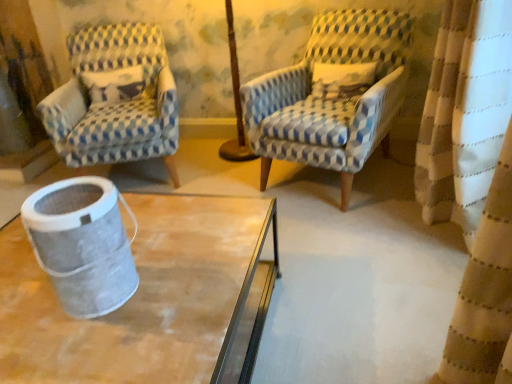
Question: Is blue and white checkered fabric armchair at center, arranged as the second chair when viewed from the left, shorter than metallic mesh trash can at lower left?

Choices:
 (A) yes
 (B) no

Answer: (B)

Question: From the image's perspective, does blue and white checkered fabric armchair at center, arranged as the second chair when viewed from the left, appear higher than metallic mesh trash can at lower left?

Choices:
 (A) yes
 (B) no

Answer: (A)

Question: Considering the relative positions of blue and white checkered fabric armchair at center, arranged as the second chair when viewed from the left, and metallic mesh trash can at lower left in the image provided, is blue and white checkered fabric armchair at center, arranged as the second chair when viewed from the left, to the right of metallic mesh trash can at lower left from the viewer's perspective?

Choices:
 (A) yes
 (B) no

Answer: (A)

Question: From a real-world perspective, is blue and white checkered fabric armchair at center, arranged as the second chair when viewed from the left, over metallic mesh trash can at lower left?

Choices:
 (A) yes
 (B) no

Answer: (B)

Question: From the image's perspective, would you say blue and white checkered fabric armchair at center, arranged as the second chair when viewed from the left, is shown under metallic mesh trash can at lower left?

Choices:
 (A) no
 (B) yes

Answer: (A)

Question: In terms of width, does blue and white checkered fabric armchair at left, the 2th chair positioned from the right, look wider or thinner when compared to metallic mesh trash can at lower left?

Choices:
 (A) wide
 (B) thin

Answer: (A)

Question: Based on their sizes in the image, would you say blue and white checkered fabric armchair at left, the first chair positioned from the left, is bigger or smaller than metallic mesh trash can at lower left?

Choices:
 (A) big
 (B) small

Answer: (A)

Question: Relative to metallic mesh trash can at lower left, is blue and white checkered fabric armchair at left, the first chair positioned from the left, in front or behind?

Choices:
 (A) front
 (B) behind

Answer: (B)

Question: From a real-world perspective, relative to metallic mesh trash can at lower left, is blue and white checkered fabric armchair at left, the 2th chair positioned from the right, vertically above or below?

Choices:
 (A) above
 (B) below

Answer: (B)

Question: From a real-world perspective, relative to blue and white checkered fabric armchair at left, the 2th chair positioned from the right, is blue and white checkered fabric armchair at center, arranged as the first chair when viewed from the right, vertically above or below?

Choices:
 (A) above
 (B) below

Answer: (A)

Question: Considering the positions of point (307, 150) and point (170, 160), is point (307, 150) closer or farther from the camera than point (170, 160)?

Choices:
 (A) farther
 (B) closer

Answer: (B)

Question: In terms of size, does blue and white checkered fabric armchair at center, arranged as the first chair when viewed from the right, appear bigger or smaller than blue and white checkered fabric armchair at left, the first chair positioned from the left?

Choices:
 (A) small
 (B) big

Answer: (A)

Question: Would you say blue and white checkered fabric armchair at center, arranged as the first chair when viewed from the right, is to the left or to the right of blue and white checkered fabric armchair at left, the 2th chair positioned from the right, in the picture?

Choices:
 (A) right
 (B) left

Answer: (A)

Question: From the image's perspective, relative to blue and white checkered fabric armchair at center, arranged as the first chair when viewed from the right, is metallic mesh trash can at lower left above or below?

Choices:
 (A) above
 (B) below

Answer: (B)

Question: Is metallic mesh trash can at lower left in front of or behind blue and white checkered fabric armchair at center, arranged as the first chair when viewed from the right, in the image?

Choices:
 (A) front
 (B) behind

Answer: (A)